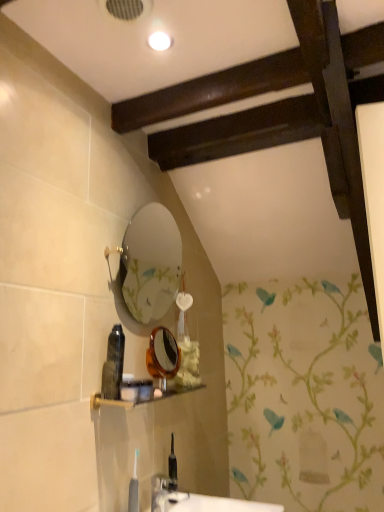
Question: Does translucent plastic bottle at center, marked as the 4th toiletry in a bottom-to-top arrangement, have a greater width compared to matte plastic shelf at lower center?

Choices:
 (A) yes
 (B) no

Answer: (B)

Question: Does translucent plastic bottle at center, marked as the 4th toiletry in a bottom-to-top arrangement, have a lesser height compared to matte plastic shelf at lower center?

Choices:
 (A) no
 (B) yes

Answer: (A)

Question: Is the depth of translucent plastic bottle at center, which appears as the 1th toiletry when viewed from the top, greater than that of matte plastic shelf at lower center?

Choices:
 (A) no
 (B) yes

Answer: (B)

Question: Is translucent plastic bottle at center, which appears as the 1th toiletry when viewed from the top, thinner than matte plastic shelf at lower center?

Choices:
 (A) yes
 (B) no

Answer: (A)

Question: Is translucent plastic bottle at center, which appears as the 1th toiletry when viewed from the top, not inside matte plastic shelf at lower center?

Choices:
 (A) no
 (B) yes

Answer: (B)

Question: Is translucent plastic bottle at center, which appears as the 1th toiletry when viewed from the top, oriented away from matte plastic shelf at lower center?

Choices:
 (A) yes
 (B) no

Answer: (B)

Question: Does translucent plastic toothbrush at lower center, the third toiletry when ordered from top to bottom, come behind translucent plastic bottle at center, marked as the 4th toiletry in a bottom-to-top arrangement?

Choices:
 (A) yes
 (B) no

Answer: (A)

Question: Is translucent plastic toothbrush at lower center, the second toiletry ordered from the bottom, taller than translucent plastic bottle at center, which appears as the 1th toiletry when viewed from the top?

Choices:
 (A) yes
 (B) no

Answer: (B)

Question: Is translucent plastic toothbrush at lower center, the third toiletry when ordered from top to bottom, next to translucent plastic bottle at center, which appears as the 1th toiletry when viewed from the top, and touching it?

Choices:
 (A) yes
 (B) no

Answer: (B)

Question: Would you say translucent plastic toothbrush at lower center, the second toiletry ordered from the bottom, is outside translucent plastic bottle at center, which appears as the 1th toiletry when viewed from the top?

Choices:
 (A) yes
 (B) no

Answer: (A)

Question: Is translucent plastic toothbrush at lower center, the third toiletry when ordered from top to bottom, smaller than translucent plastic bottle at center, marked as the 4th toiletry in a bottom-to-top arrangement?

Choices:
 (A) no
 (B) yes

Answer: (B)

Question: Considering the relative positions of translucent plastic toothbrush at lower center, the third toiletry when ordered from top to bottom, and translucent plastic bottle at center, marked as the 4th toiletry in a bottom-to-top arrangement, in the image provided, is translucent plastic toothbrush at lower center, the third toiletry when ordered from top to bottom, in front of translucent plastic bottle at center, marked as the 4th toiletry in a bottom-to-top arrangement,?

Choices:
 (A) no
 (B) yes

Answer: (A)

Question: Is the depth of matte plastic shelf at lower center less than that of translucent amber mirror at center?

Choices:
 (A) yes
 (B) no

Answer: (A)